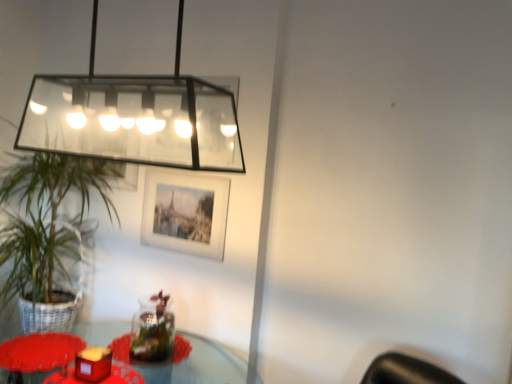
Question: From the image's perspective, is clear glass rectangular light fixture at upper left under green leafy plant at left?

Choices:
 (A) no
 (B) yes

Answer: (A)

Question: Is clear glass rectangular light fixture at upper left at the right side of green leafy plant at left?

Choices:
 (A) yes
 (B) no

Answer: (A)

Question: Is clear glass rectangular light fixture at upper left smaller than green leafy plant at left?

Choices:
 (A) yes
 (B) no

Answer: (A)

Question: Does clear glass rectangular light fixture at upper left lie behind green leafy plant at left?

Choices:
 (A) yes
 (B) no

Answer: (B)

Question: From a real-world perspective, is clear glass rectangular light fixture at upper left positioned over green leafy plant at left based on gravity?

Choices:
 (A) no
 (B) yes

Answer: (B)

Question: Is the position of clear glass rectangular light fixture at upper left less distant than that of green leafy plant at left?

Choices:
 (A) yes
 (B) no

Answer: (A)

Question: Does clear glass rectangular light fixture at upper left come in front of translucent glass table at lower left?

Choices:
 (A) yes
 (B) no

Answer: (A)

Question: From the image's perspective, is clear glass rectangular light fixture at upper left above translucent glass table at lower left?

Choices:
 (A) no
 (B) yes

Answer: (B)

Question: Is clear glass rectangular light fixture at upper left wider than translucent glass table at lower left?

Choices:
 (A) no
 (B) yes

Answer: (A)

Question: Is translucent glass table at lower left inside clear glass rectangular light fixture at upper left?

Choices:
 (A) no
 (B) yes

Answer: (A)

Question: Can you confirm if clear glass rectangular light fixture at upper left is taller than translucent glass table at lower left?

Choices:
 (A) no
 (B) yes

Answer: (B)

Question: Is clear glass rectangular light fixture at upper left positioned beyond the bounds of translucent glass table at lower left?

Choices:
 (A) yes
 (B) no

Answer: (A)

Question: Can you confirm if green leafy plant at left is thinner than matte red candle at lower left?

Choices:
 (A) no
 (B) yes

Answer: (A)